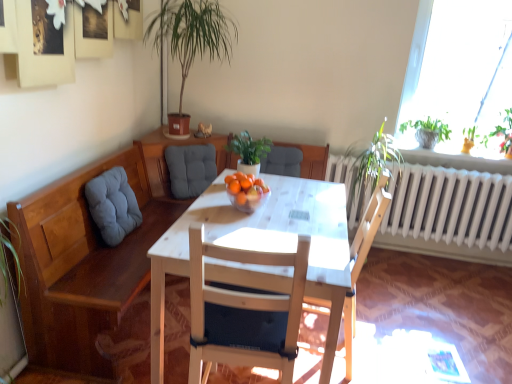
Question: From a real-world perspective, is gray fabric cushion at left above or below green matte plant at center, which is the second houseplant in top-to-bottom order?

Choices:
 (A) above
 (B) below

Answer: (B)

Question: Does point (118, 226) appear closer or farther from the camera than point (263, 155)?

Choices:
 (A) farther
 (B) closer

Answer: (B)

Question: Estimate the real-world distances between objects in this image. Which object is farther from the orange matte at table center?

Choices:
 (A) green matte plant at center, which ranks as the 1th houseplant in bottom-to-top order
 (B) gray fabric cushion at left
 (C) translucent glass bowl at center
 (D) white wood chair at center, which ranks as the 1th chair in front-to-back order
 (E) wooden chair at center, which is the 2th chair in front-to-back order

Answer: (E)

Question: Estimate the real-world distances between objects in this image. Which object is farther from the gray fabric cushion at left?

Choices:
 (A) gray fabric cushion at center, the 2th chair viewed from the back
 (B) green matte plant at center, which ranks as the 1th houseplant in bottom-to-top order
 (C) green leafy plant at upper right
 (D) matte gray cushioned chair at center, the fourth chair when ordered from front to back
 (E) white wood chair at center, positioned as the 4th chair in back-to-front order

Answer: (C)